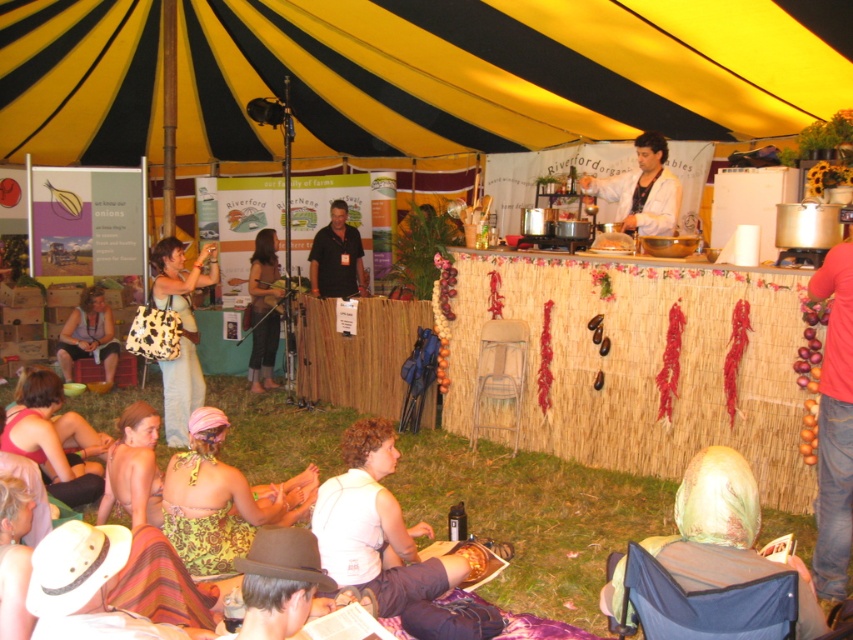
Can you confirm if yellow/black striped canopy at upper center is positioned to the right of green floral dress at lower left?

Indeed, yellow/black striped canopy at upper center is positioned on the right side of green floral dress at lower left.

Between yellow/black striped canopy at upper center and green floral dress at lower left, which one has more height?

With more height is green floral dress at lower left.

Who is more distant from viewer, (329, 52) or (152, 417)?

Point (329, 52)

You are a GUI agent. You are given a task and a screenshot of the screen. Output one action in this format:
    pyautogui.click(x=<x>, y=<y>)
    Task: Click on the yellow/black striped canopy at upper center
    This screenshot has height=640, width=853.
    Given the screenshot: What is the action you would take?
    pyautogui.click(x=503, y=72)

Does matte black dress at center have a greater height compared to matte black tank top at lower left?

Correct, matte black dress at center is much taller as matte black tank top at lower left.

The image size is (853, 640). What do you see at coordinates (263, 310) in the screenshot? I see `matte black dress at center` at bounding box center [263, 310].

In order to click on matte black dress at center in this screenshot , I will do `click(263, 310)`.

Which is behind, point (45, 408) or point (651, 189)?

Positioned behind is point (651, 189).

Does matte pink bikini at lower left appear on the right side of white matte jacket at upper center?

In fact, matte pink bikini at lower left is to the left of white matte jacket at upper center.

Which is in front, point (77, 468) or point (614, 188)?

Point (77, 468) is more forward.

Image resolution: width=853 pixels, height=640 pixels. Identify the location of matte pink bikini at lower left. (49, 442).